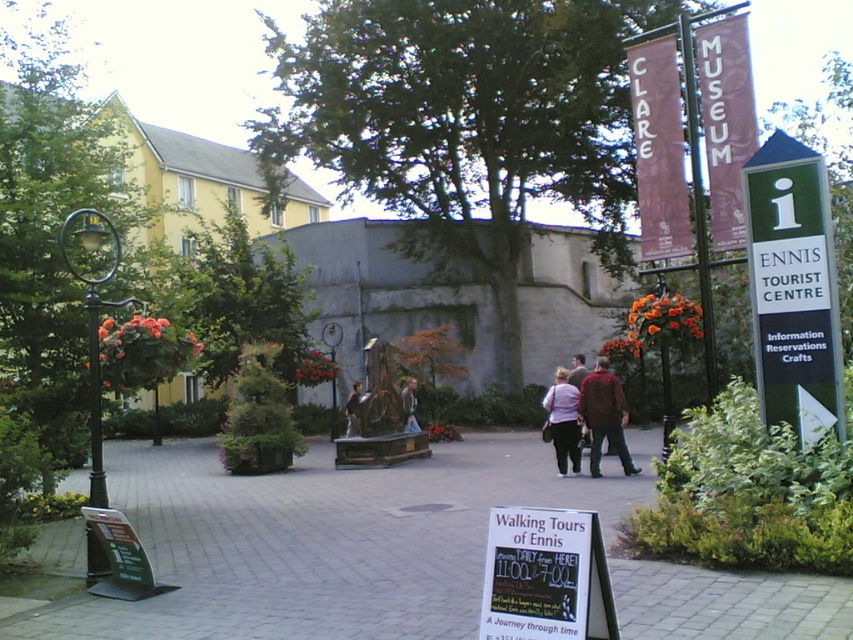
Question: Does striped fabric jacket at center have a lesser width compared to dark brown leather jacket at center?

Choices:
 (A) no
 (B) yes

Answer: (A)

Question: Considering the real-world distances, which object is farthest from the striped fabric jacket at center?

Choices:
 (A) matte pink sweater at center
 (B) green plastic sign at right
 (C) paved stone at center

Answer: (B)

Question: Estimate the real-world distances between objects in this image. Which object is farther from the bronze statue at center?

Choices:
 (A) green plastic sign at right
 (B) dark brown leather jacket at center
 (C) matte pink sweater at center

Answer: (A)

Question: Is green plastic sign at right positioned before dark brown leather jacket at center?

Choices:
 (A) no
 (B) yes

Answer: (B)

Question: Which object appears closest to the camera in this image?

Choices:
 (A) striped fabric jacket at center
 (B) matte pink sweater at center
 (C) green plastic sign at right

Answer: (C)

Question: Can you confirm if green plastic sign at right is positioned to the right of matte pink sweater at center?

Choices:
 (A) yes
 (B) no

Answer: (A)